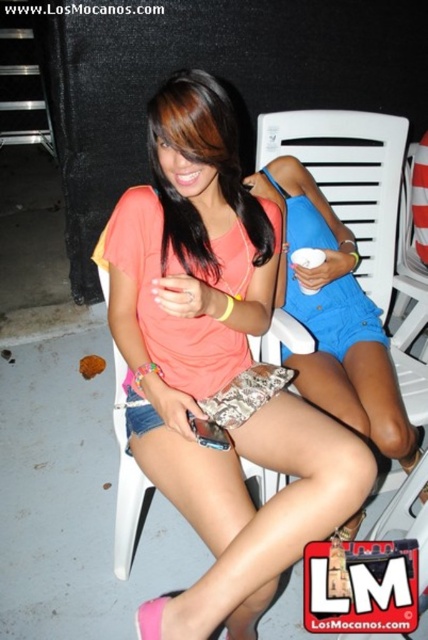
Question: Observing the image, what is the correct spatial positioning of matte coral tank top at center in reference to matte peach top at center?

Choices:
 (A) above
 (B) below

Answer: (B)

Question: Which of the following is the closest to the observer?

Choices:
 (A) (225, 188)
 (B) (213, 586)

Answer: (B)

Question: Is matte coral tank top at center closer to camera compared to matte peach top at center?

Choices:
 (A) no
 (B) yes

Answer: (B)

Question: From the image, what is the correct spatial relationship of matte coral tank top at center in relation to matte peach top at center?

Choices:
 (A) left
 (B) right

Answer: (B)

Question: Which object is farther from the camera taking this photo?

Choices:
 (A) matte peach top at center
 (B) matte coral tank top at center

Answer: (A)